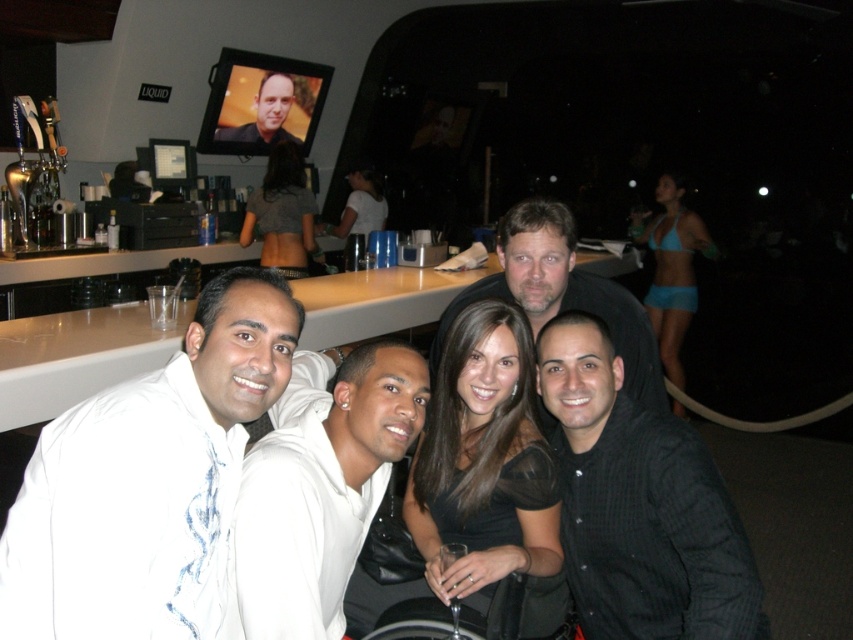
You are a photographer trying to capture a closeup of the gray fabric top at upper center and the matte black shirt at center. Which object should you zoom in on to ensure both are in frame without moving the camera?

The gray fabric top at upper center might be wider than matte black shirt at center, so you should zoom in on the matte black shirt at center to ensure both are in frame without moving the camera.

You are a photographer trying to capture a group photo of the black matte shirt at center and the matte black dress at center. Since you want to focus on the smaller object, which one should you zoom in on?

The black matte shirt at center is smaller than the matte black dress at center, so you should zoom in on the black matte shirt at center to focus on the smaller object.

You are standing at the entrance of the bar and see two points marked in the scene. The first point is located at coordinate point (490, 445) and the second point is at coordinate point (708, 252). Which point is closer to you?

Point (490, 445) is in front of point (708, 252), so it is closer to you.